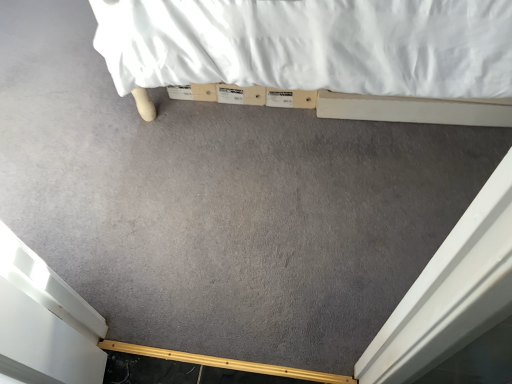
Where is `free location in front of white matte bed at upper center`? This screenshot has width=512, height=384. free location in front of white matte bed at upper center is located at coordinates [292, 228].